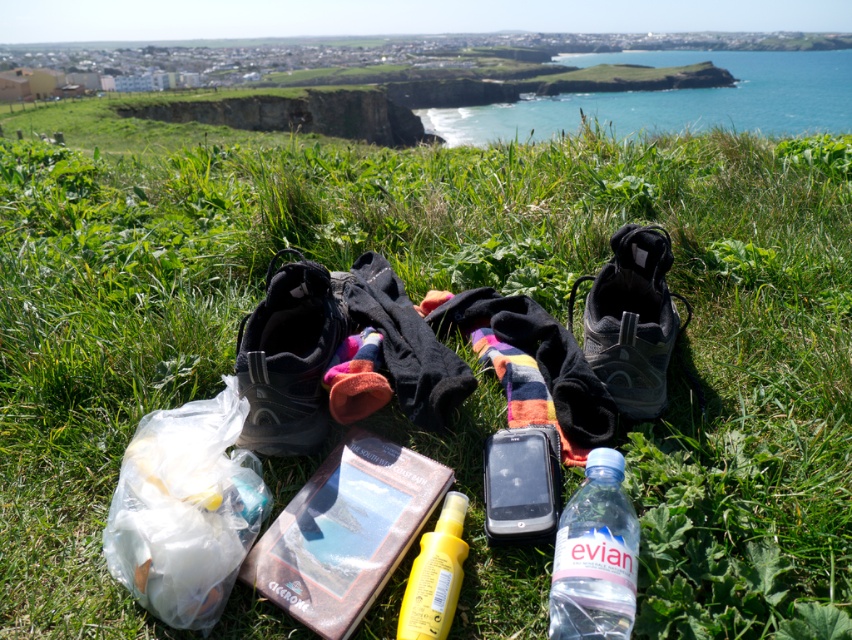
You are a GUI agent. You are given a task and a screenshot of the screen. Output one action in this format:
    pyautogui.click(x=<x>, y=<y>)
    Task: Click on the black mesh shoe at center
    The width and height of the screenshot is (852, 640).
    Given the screenshot: What is the action you would take?
    pyautogui.click(x=631, y=320)

Between point (635, 387) and point (550, 605), which one is positioned in front?

Point (550, 605)

Where is `black mesh shoe at center`? The image size is (852, 640). black mesh shoe at center is located at coordinates (631, 320).

Who is more distant from viewer, (579, 602) or (417, 620)?

Positioned behind is point (417, 620).

Between clear plastic bottle at center and yellow matte bottle at center, which one is positioned lower?

yellow matte bottle at center is below.

This screenshot has height=640, width=852. I want to click on clear plastic bottle at center, so click(x=596, y=556).

Which of these two, matte black shoe at center or yellow matte bottle at center, stands shorter?

→ yellow matte bottle at center

Is point (281, 404) positioned before point (446, 593)?

That is False.

Does point (262, 426) come behind point (445, 582)?

Yes, it is behind point (445, 582).

I want to click on matte black shoe at center, so click(x=288, y=358).